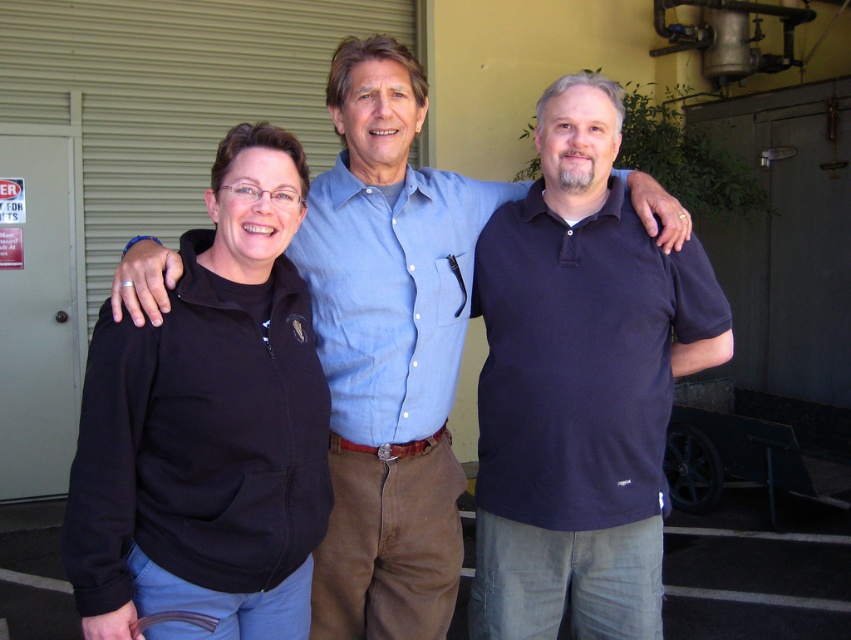
Can you confirm if dark blue polo shirt at center is positioned to the left of blue cotton shirt at center?

In fact, dark blue polo shirt at center is to the right of blue cotton shirt at center.

Describe the element at coordinates (580, 385) in the screenshot. The image size is (851, 640). I see `dark blue polo shirt at center` at that location.

Find the location of a particular element. The width and height of the screenshot is (851, 640). dark blue polo shirt at center is located at coordinates (580, 385).

Is dark blue polo shirt at center smaller than black fleece jacket at left?

No, dark blue polo shirt at center is not smaller than black fleece jacket at left.

Can you confirm if dark blue polo shirt at center is thinner than black fleece jacket at left?

No.

Does point (661, 262) lie behind point (214, 540)?

Yes, it is.

Locate an element on the screen. dark blue polo shirt at center is located at coordinates (580, 385).

Which is below, dark blue polo shirt at center or white metal door at left?

dark blue polo shirt at center is below.

Can you confirm if dark blue polo shirt at center is positioned below white metal door at left?

Yes, dark blue polo shirt at center is below white metal door at left.

What are the coordinates of `dark blue polo shirt at center` in the screenshot? It's located at (580, 385).

Where is `dark blue polo shirt at center`? The width and height of the screenshot is (851, 640). dark blue polo shirt at center is located at coordinates (580, 385).